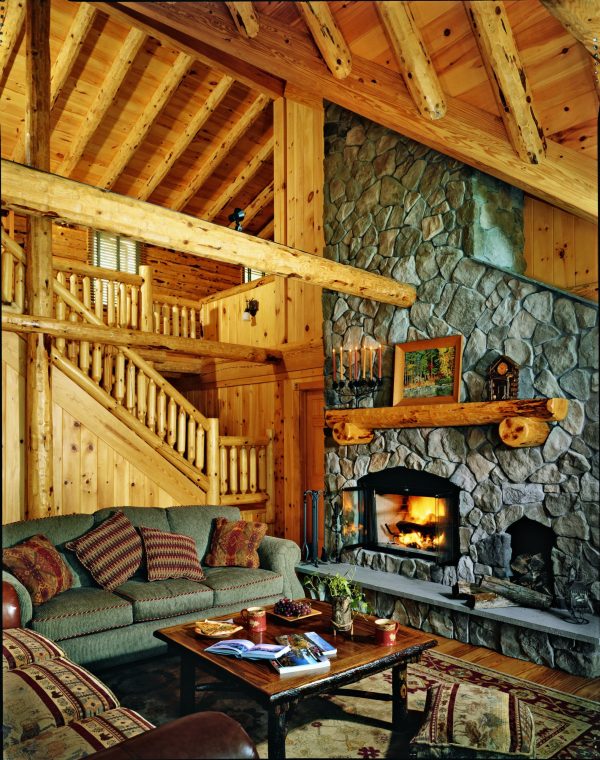
The width and height of the screenshot is (600, 760). I want to click on brown sofa arm on right, so click(220, 748).